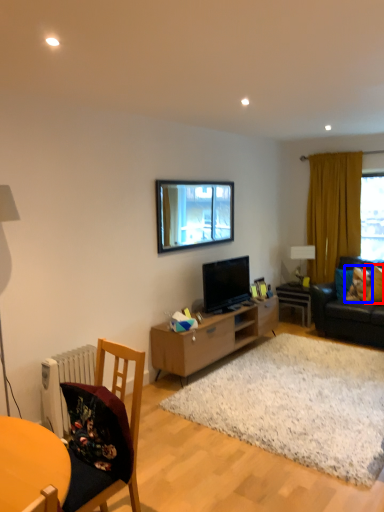
Question: Which object appears farthest to the camera in this image, pillow (highlighted by a red box) or pillow (highlighted by a blue box)?

Choices:
 (A) pillow
 (B) pillow

Answer: (B)